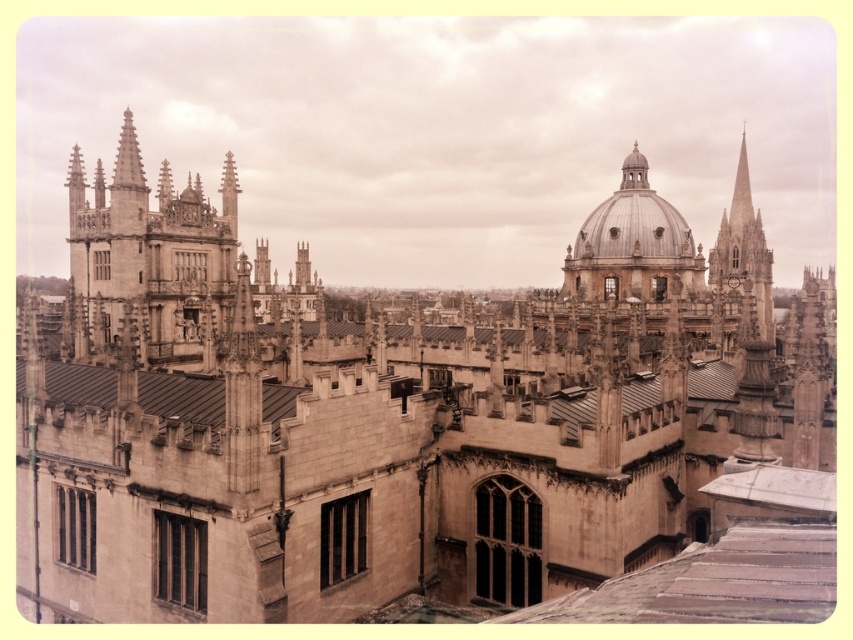
Question: Can you confirm if brown metal roof at center is wider than white marble roof at lower right?

Choices:
 (A) yes
 (B) no

Answer: (A)

Question: Estimate the real-world distances between objects in this image. Which object is farther from the smooth stone spire at right?

Choices:
 (A) white marble roof at lower right
 (B) smooth stone spire at upper center
 (C) brown metal roof at center

Answer: (C)

Question: Among these points, which one is nearest to the camera?

Choices:
 (A) (621, 253)
 (B) (764, 326)
 (C) (235, 196)
 (D) (776, 486)

Answer: (D)

Question: Which is nearer to the smooth gray slate roof at center?

Choices:
 (A) white marble roof at lower right
 (B) smooth stone spire at right
 (C) brown metal roof at center
 (D) smooth stone spire at upper center

Answer: (A)

Question: Is silver dome at center closer to the viewer compared to smooth stone spire at right?

Choices:
 (A) yes
 (B) no

Answer: (B)

Question: Can you confirm if smooth gray slate roof at center is bigger than white marble roof at lower right?

Choices:
 (A) no
 (B) yes

Answer: (B)